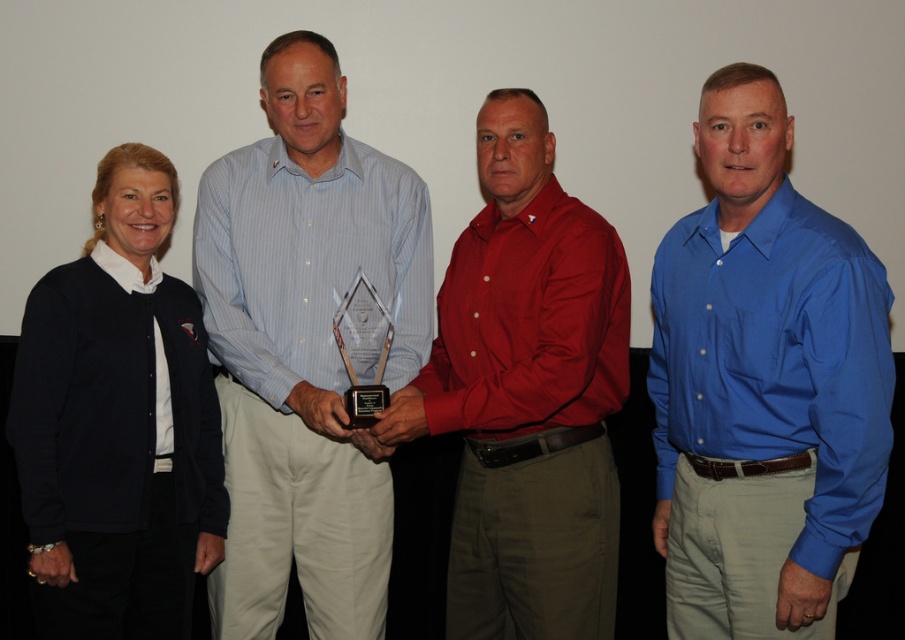
Question: Which of the following is the closest to the observer?

Choices:
 (A) navy blue sweater at left
 (B) shiny red shirt at center

Answer: (A)

Question: Based on their relative distances, which object is nearer to the blue smooth shirt at right?

Choices:
 (A) shiny red shirt at center
 (B) navy blue sweater at left
 (C) blue striped shirt at center

Answer: (A)

Question: Does blue smooth shirt at right come in front of shiny red shirt at center?

Choices:
 (A) yes
 (B) no

Answer: (A)

Question: Which object is farther from the camera taking this photo?

Choices:
 (A) shiny red shirt at center
 (B) blue smooth shirt at right
 (C) navy blue sweater at left

Answer: (A)

Question: Is blue striped shirt at center thinner than navy blue sweater at left?

Choices:
 (A) no
 (B) yes

Answer: (A)

Question: Does blue smooth shirt at right appear on the left side of navy blue sweater at left?

Choices:
 (A) yes
 (B) no

Answer: (B)